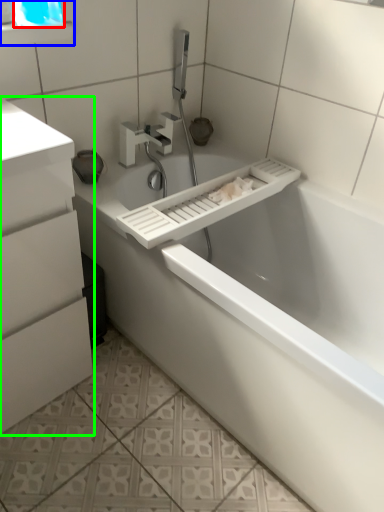
Question: Which object is positioned closest to window screen (highlighted by a red box)? Select from medicine cabinet (highlighted by a blue box) and bathroom cabinet (highlighted by a green box).

Choices:
 (A) medicine cabinet
 (B) bathroom cabinet

Answer: (A)